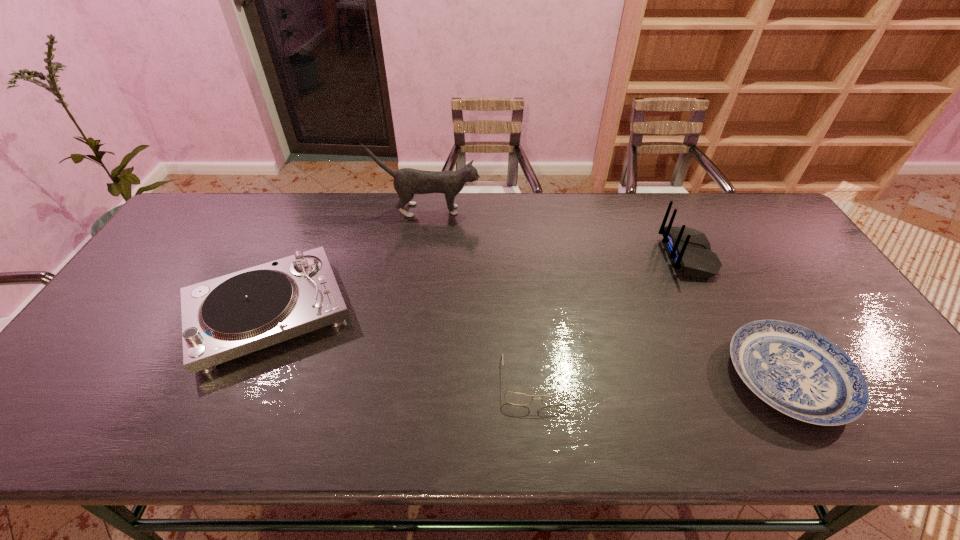
At what (x,y) coordinates should I click in order to perform the action: click on the tallest object. Please return your answer as a coordinate pair (x, y). Looking at the image, I should click on (407, 181).

Identify the location of the farthest object. Image resolution: width=960 pixels, height=540 pixels. (407, 181).

In order to click on the fourth shortest object in this screenshot , I will do [x=689, y=249].

At what (x,y) coordinates should I click in order to perform the action: click on the third shortest object. Please return your answer as a coordinate pair (x, y). Looking at the image, I should click on (224, 318).

Where is `the third object from right to left`? the third object from right to left is located at coordinates (514, 398).

The image size is (960, 540). I want to click on plate, so click(x=797, y=371).

Locate an element on the screen. The height and width of the screenshot is (540, 960). vacant space located at the face of the farthest object is located at coordinates (503, 210).

Image resolution: width=960 pixels, height=540 pixels. Find the location of `free space located 0.050m on the back of the router`. free space located 0.050m on the back of the router is located at coordinates 648,255.

Locate an element on the screen. This screenshot has height=540, width=960. free space located 0.080m on the back of the router is located at coordinates (637, 255).

Where is `vacant space situated 0.110m on the back of the router`? vacant space situated 0.110m on the back of the router is located at coordinates pos(628,255).